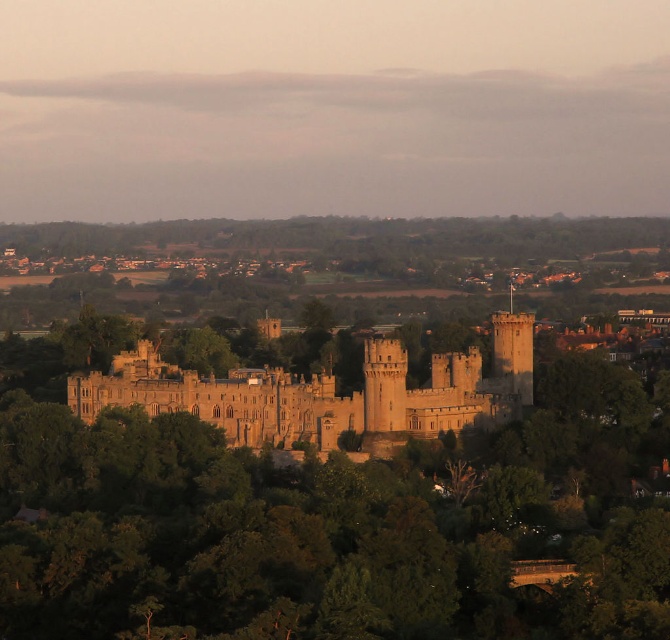
Is green leafy tree at center thinner than golden stone castle at center?

Incorrect, green leafy tree at center's width is not less than golden stone castle at center's.

Does green leafy tree at center lie in front of golden stone castle at center?

Yes, it is in front of golden stone castle at center.

What do you see at coordinates (328, 493) in the screenshot? This screenshot has height=640, width=670. I see `green leafy tree at center` at bounding box center [328, 493].

Image resolution: width=670 pixels, height=640 pixels. In order to click on green leafy tree at center in this screenshot , I will do `click(328, 493)`.